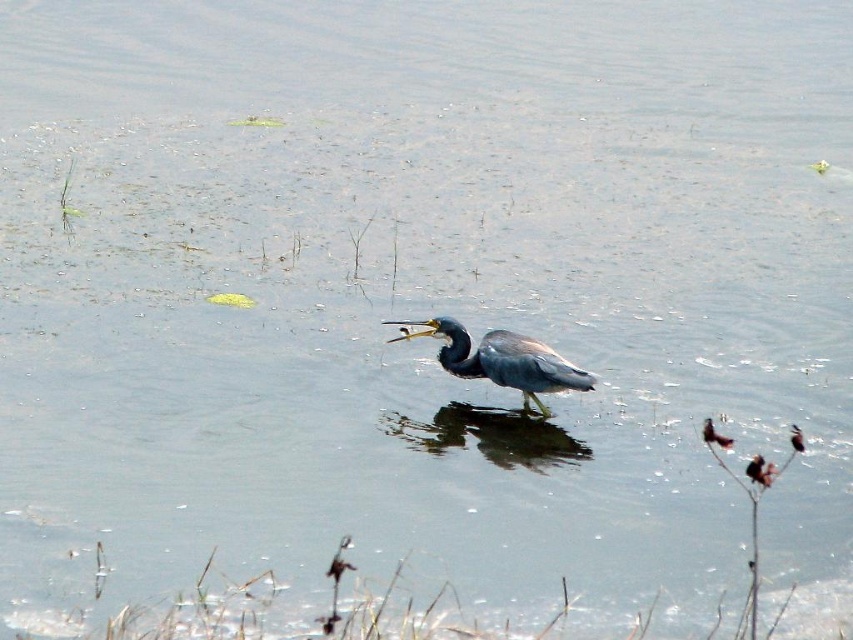
Question: Which point is farther to the camera?

Choices:
 (A) (790, 442)
 (B) (763, 467)

Answer: (A)

Question: Is shiny black bird at center above gray matte bird at center?

Choices:
 (A) no
 (B) yes

Answer: (B)

Question: Considering the relative positions of shiny brown bird at center and shiny black bird at center in the image provided, where is shiny brown bird at center located with respect to shiny black bird at center?

Choices:
 (A) right
 (B) left

Answer: (A)

Question: Based on their relative distances, which object is farther from the shiny brown bird at center?

Choices:
 (A) shiny black bird at center
 (B) shiny blue-gray heron at center

Answer: (B)

Question: Is shiny blue-gray heron at center smaller than gray matte bird at center?

Choices:
 (A) yes
 (B) no

Answer: (B)

Question: Based on their relative distances, which object is farther from the gray matte bird at center?

Choices:
 (A) shiny black bird at center
 (B) shiny brown bird at center
 (C) shiny blue-gray heron at center

Answer: (B)